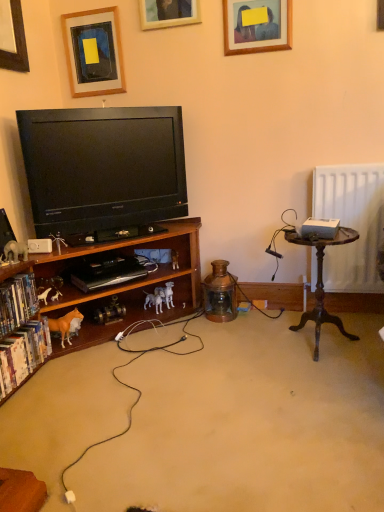
This screenshot has width=384, height=512. In order to click on vacant area to the right of brown matte horse at lower left in this screenshot , I will do `click(95, 353)`.